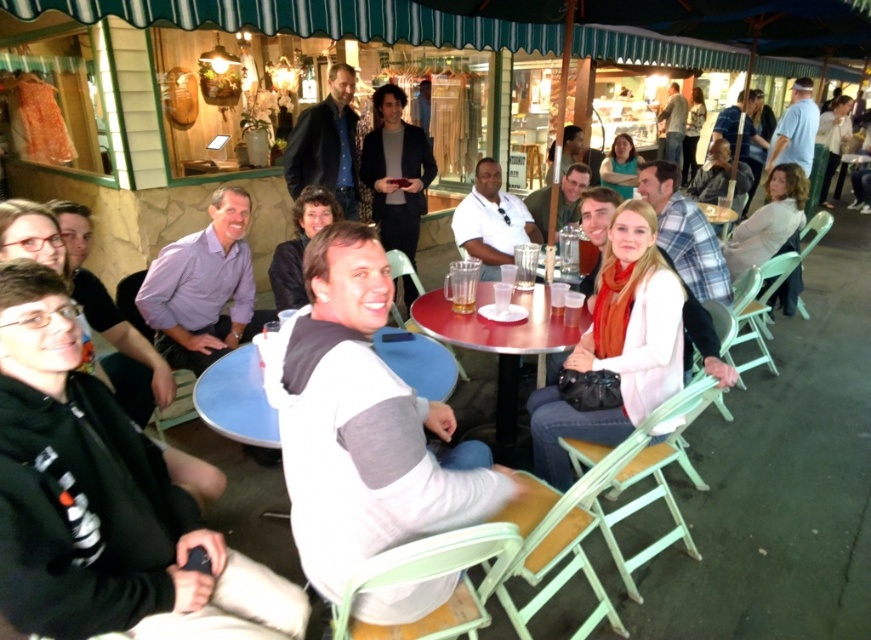
Is point (242, 355) farther from camera compared to point (404, 300)?

No, (242, 355) is in front of (404, 300).

Identify the location of blue plastic table at center. (237, 400).

Measure the distance between black hoodie at lower left and white matte jacket at center.

1.46 meters

Is black hoodie at lower left above white matte jacket at center?

Actually, black hoodie at lower left is below white matte jacket at center.

Between point (129, 529) and point (612, 234), which one is positioned in front?

Positioned in front is point (129, 529).

Identify the location of black hoodie at lower left. This screenshot has height=640, width=871. (106, 500).

Between purple shirt at center and dark gray wool sweater at center, which one appears on the left side from the viewer's perspective?

Positioned to the left is purple shirt at center.

Image resolution: width=871 pixels, height=640 pixels. What do you see at coordinates (203, 288) in the screenshot? I see `purple shirt at center` at bounding box center [203, 288].

Between point (240, 308) and point (403, 288), which one is positioned behind?

The point (403, 288) is more distant.

The height and width of the screenshot is (640, 871). I want to click on purple shirt at center, so click(x=203, y=288).